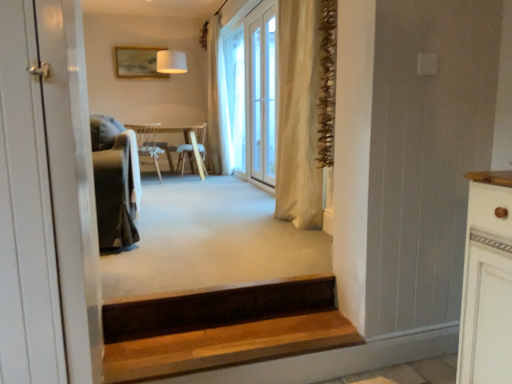
Identify the location of free location in front of beige fabric curtain at center, the first curtain in the front-to-back sequence. This screenshot has height=384, width=512. (281, 238).